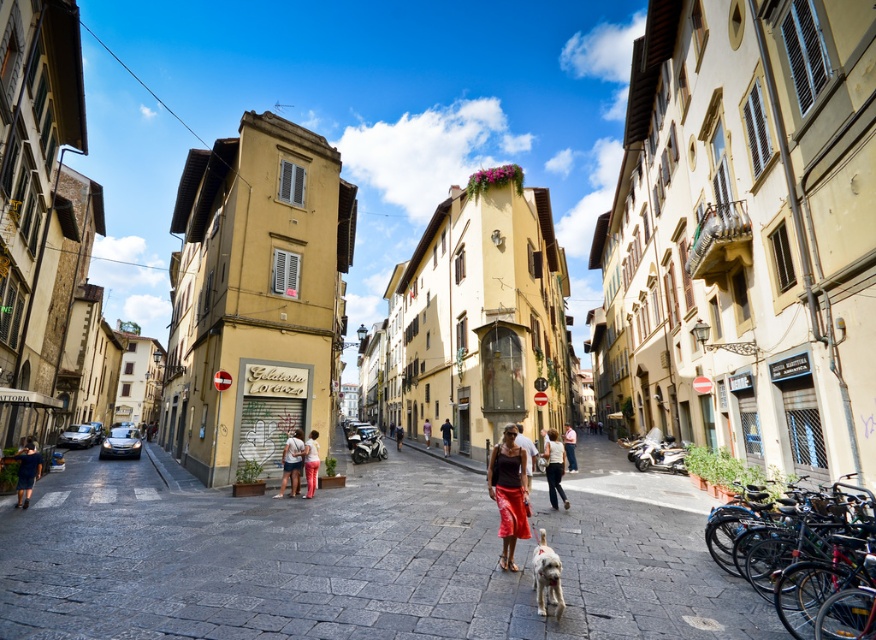
Question: Considering the relative positions of matte white shirt at center and purple cotton shirt at center in the image provided, where is matte white shirt at center located with respect to purple cotton shirt at center?

Choices:
 (A) below
 (B) above

Answer: (B)

Question: Is matte white shirt at center above matte pink pants at center?

Choices:
 (A) no
 (B) yes

Answer: (A)

Question: Which point appears closest to the camera in this image?

Choices:
 (A) (563, 500)
 (B) (553, 561)

Answer: (B)

Question: Which of these objects is positioned farthest from the purple cotton shirt at center?

Choices:
 (A) smooth stone alley at center
 (B) dark blue jeans at lower left
 (C) light blue denim jeans at center
 (D) matte pink pants at center

Answer: (B)

Question: Among these objects, which one is farthest from the camera?

Choices:
 (A) light beige pants at center
 (B) smooth stone alley at center
 (C) matte brown pants at center

Answer: (C)

Question: Is smooth stone alley at center to the right of light brown fur at center from the viewer's perspective?

Choices:
 (A) no
 (B) yes

Answer: (A)